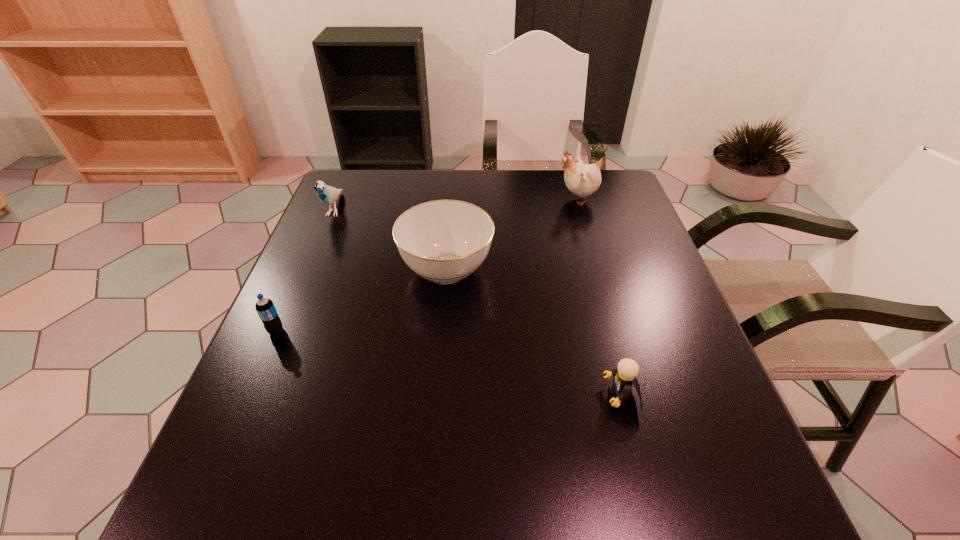
Image resolution: width=960 pixels, height=540 pixels. Identify the location of vacant area between the fourth farthest object and the left bird. click(305, 270).

In order to click on free space between the nearest object and the chinaware in this screenshot , I will do `click(534, 333)`.

I want to click on free area in between the shorter bird and the Lego, so click(x=478, y=303).

Find the location of a particular element. The image size is (960, 540). free space between the left bird and the nearest object is located at coordinates (478, 303).

Image resolution: width=960 pixels, height=540 pixels. In order to click on the fourth closest object to the nearest object in this screenshot , I will do `click(327, 194)`.

Image resolution: width=960 pixels, height=540 pixels. I want to click on object identified as the second closest to the third object from right to left, so click(x=581, y=179).

Locate an element on the screen. The height and width of the screenshot is (540, 960). vacant region that satisfies the following two spatial constraints: 1. at the face of the chinaware; 2. on the left side of the shorter bird is located at coordinates (309, 269).

Where is `free location that satisfies the following two spatial constraints: 1. at the face of the left bird; 2. on the left side of the third object from left to right`? free location that satisfies the following two spatial constraints: 1. at the face of the left bird; 2. on the left side of the third object from left to right is located at coordinates (309, 269).

What are the coordinates of `free space in the image that satisfies the following two spatial constraints: 1. at the face of the chinaware; 2. on the left side of the left bird` in the screenshot? It's located at (309, 269).

Identify the location of vacant space that satisfies the following two spatial constraints: 1. at the face of the third farthest object; 2. on the right side of the shorter bird. Image resolution: width=960 pixels, height=540 pixels. (309, 269).